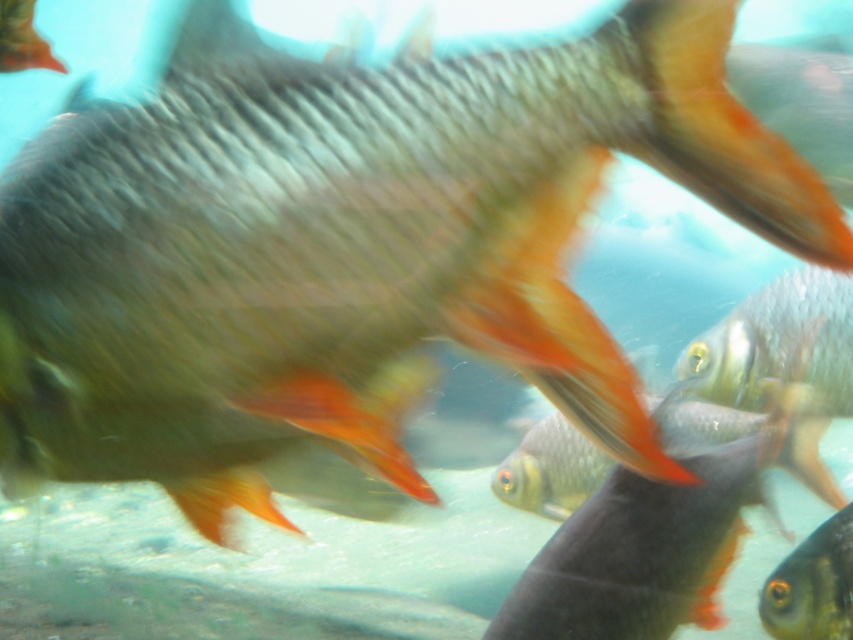
Question: Among these objects, which one is farthest from the camera?

Choices:
 (A) shiny silver fish at center
 (B) matte orange fish at upper left

Answer: (B)

Question: Observing the image, what is the correct spatial positioning of shiny silver fish at center in reference to matte orange fish at upper left?

Choices:
 (A) right
 (B) left

Answer: (A)

Question: Can you confirm if shiny silver fish at center is wider than matte orange fish at upper left?

Choices:
 (A) yes
 (B) no

Answer: (A)

Question: Does shiny silver fish at center appear on the left side of matte orange fish at upper left?

Choices:
 (A) yes
 (B) no

Answer: (B)

Question: Which point is farther to the camera?

Choices:
 (A) shiny silver fish at center
 (B) matte orange fish at upper left

Answer: (B)